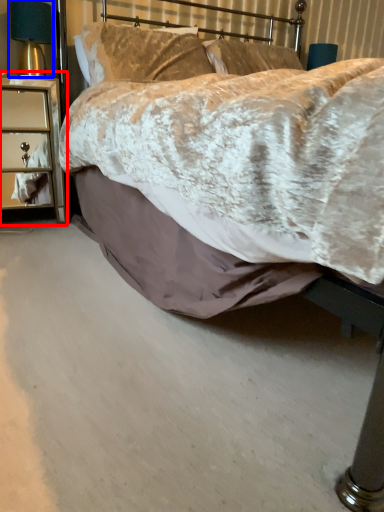
Question: Which object is further to the camera taking this photo, nightstand (highlighted by a red box) or bedside lamp (highlighted by a blue box)?

Choices:
 (A) nightstand
 (B) bedside lamp

Answer: (B)